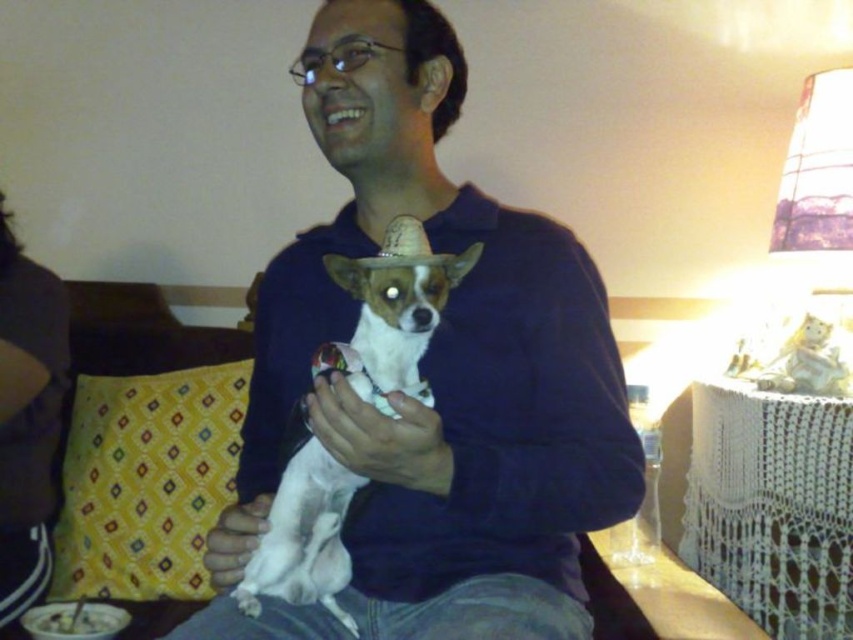
Question: Considering the real-world distances, which object is closest to the white fur dog at center?

Choices:
 (A) blue cotton shirt at center
 (B) yellow fabric pillow at lower left

Answer: (A)

Question: Among these objects, which one is farthest from the camera?

Choices:
 (A) white fur dog at center
 (B) yellow fabric pillow at lower left
 (C) blue cotton shirt at center

Answer: (B)

Question: Can you confirm if yellow fabric pillow at lower left is wider than white fur dog at center?

Choices:
 (A) no
 (B) yes

Answer: (B)

Question: Does yellow fabric pillow at lower left come behind white fur dog at center?

Choices:
 (A) yes
 (B) no

Answer: (A)

Question: Which is farther from the white fur dog at center?

Choices:
 (A) yellow fabric pillow at lower left
 (B) blue cotton shirt at center

Answer: (A)

Question: Can you confirm if blue cotton shirt at center is positioned to the left of white fur dog at center?

Choices:
 (A) yes
 (B) no

Answer: (B)